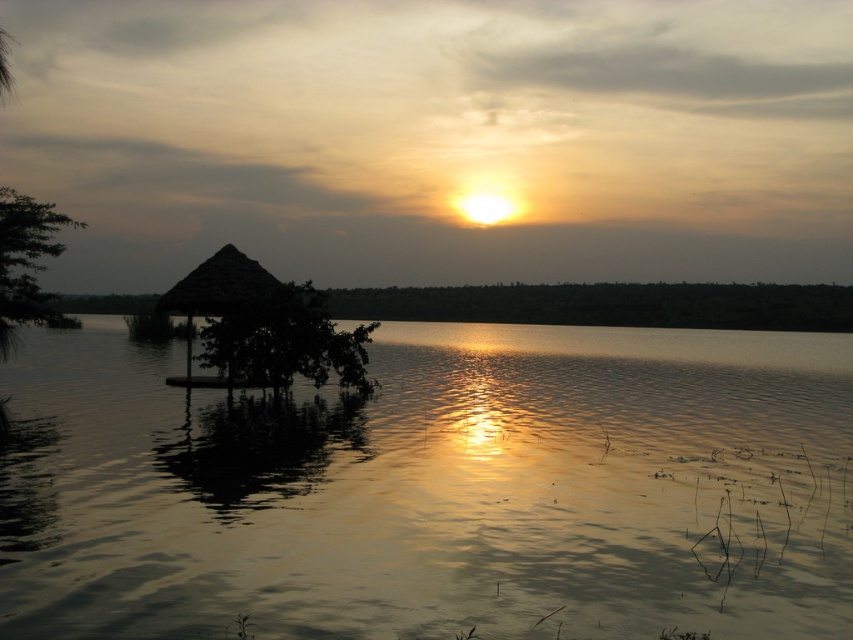
You are standing at the point with coordinates point [434,490]. What structure are you standing on?

You are standing on the matte thatched hut at left.

You are standing on the shore of the lake and see the matte thatched hut at left and the thatched straw hut at center. Which one is positioned to the right side of the other?

The matte thatched hut at left is positioned to the right of the thatched straw hut at center.

You are planning to place a small wooden bench between the matte thatched hut at left and the thatched straw hut at center. Which of the two huts will have more space available on its side for the bench?

The matte thatched hut at left has a larger width than the thatched straw hut at center, so there will be more space available on its side for the bench.